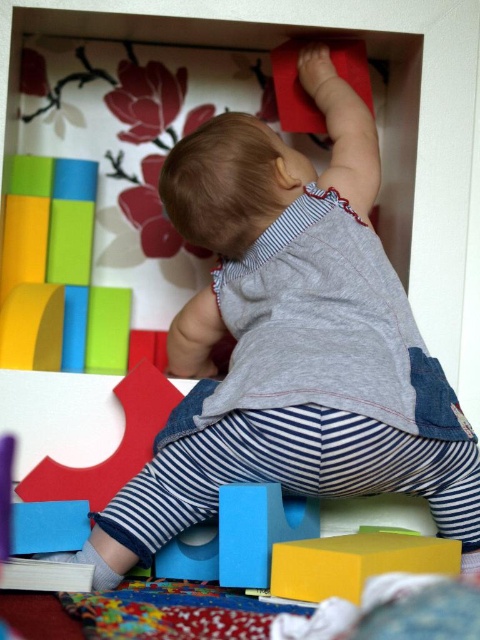
What do you see at coordinates (355, 563) in the screenshot?
I see `yellow matte block at lower center` at bounding box center [355, 563].

Can you confirm if yellow matte block at lower center is positioned to the right of matte blue block at lower center?

Correct, you'll find yellow matte block at lower center to the right of matte blue block at lower center.

Is point (352, 592) positioned after point (224, 522)?

That is False.

Identify the location of yellow matte block at lower center. This screenshot has height=640, width=480. (355, 563).